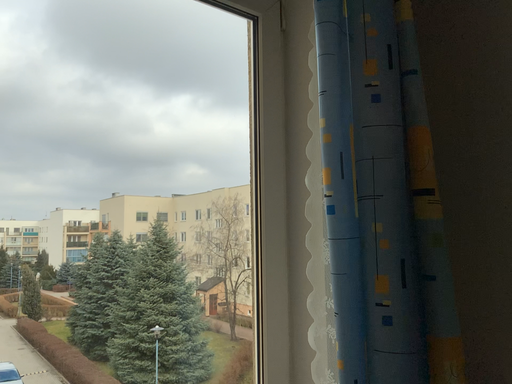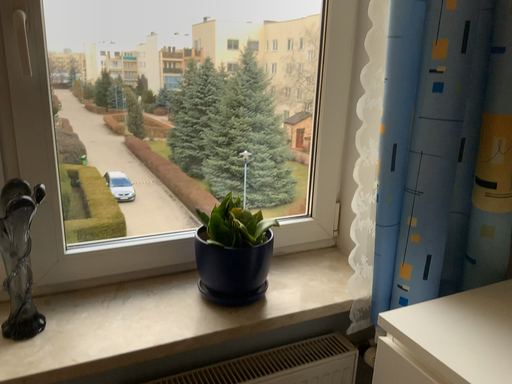
Question: Which way did the camera rotate in the video?

Choices:
 (A) rotated downward
 (B) rotated upward

Answer: (A)